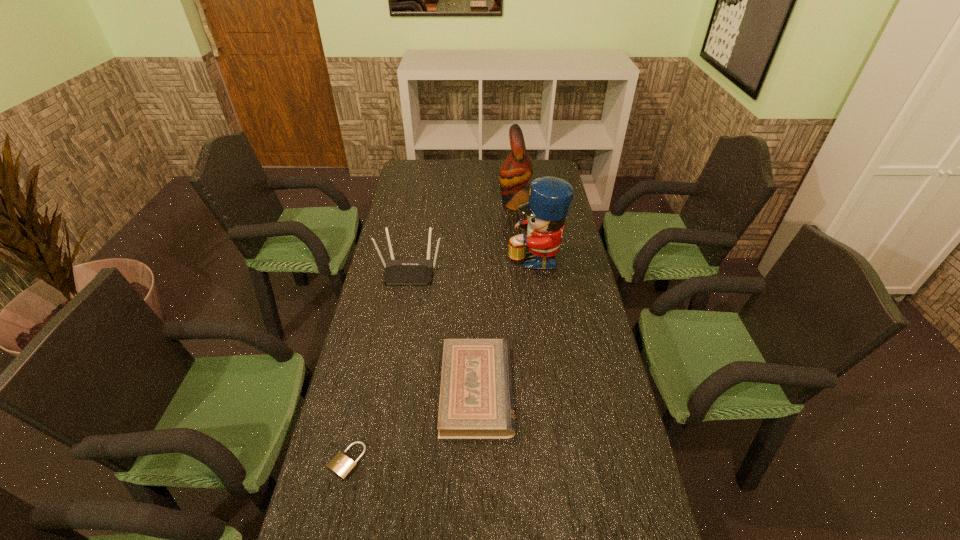
Identify the location of empty space that is in between the fourth tallest object and the padlock. Image resolution: width=960 pixels, height=540 pixels. (412, 426).

Where is `free space between the third shortest object and the farthest object`? free space between the third shortest object and the farthest object is located at coordinates (463, 237).

This screenshot has height=540, width=960. I want to click on empty location between the second shortest object and the parrot, so click(496, 296).

Find the location of a particular element. Image resolution: width=960 pixels, height=540 pixels. free space between the nutcracker and the parrot is located at coordinates (525, 230).

The height and width of the screenshot is (540, 960). What are the coordinates of `the second closest object relative to the parrot` in the screenshot? It's located at (396, 271).

Identify which object is the fourth nearest to the router. Please provide its 2D coordinates. Your answer should be formatted as a tuple, i.e. [(x, y)], where the tuple contains the x and y coordinates of a point satisfying the conditions above.

[(341, 465)]

The image size is (960, 540). I want to click on free spot that satisfies the following two spatial constraints: 1. on the front-facing side of the nutcracker; 2. on the front-facing side of the router, so (x=537, y=271).

I want to click on vacant space that satisfies the following two spatial constraints: 1. on the face of the parrot; 2. on the front-facing side of the third tallest object, so click(524, 271).

In order to click on free location that satisfies the following two spatial constraints: 1. on the face of the parrot; 2. on the front-facing side of the router in this screenshot , I will do `click(524, 271)`.